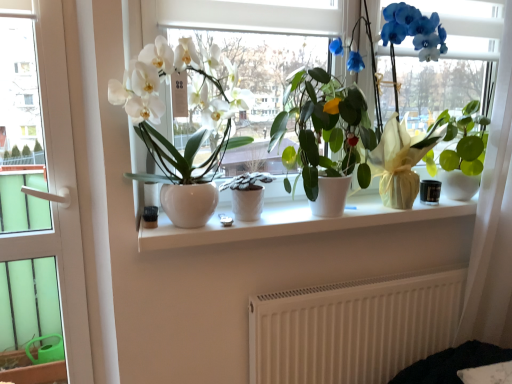
Question: Choose the correct answer: Is white sheer curtain at right inside green glossy leafy plant at right, acting as the 3th houseplant starting from the left, or outside it?

Choices:
 (A) outside
 (B) inside

Answer: (A)

Question: Is point (477, 206) closer or farther from the camera than point (450, 150)?

Choices:
 (A) closer
 (B) farther

Answer: (B)

Question: Which is farther from the white matte radiator at lower center?

Choices:
 (A) matte white vase at center, acting as the 3th houseplant starting from the right
 (B) white sheer curtain at right
 (C) white textured pot at center, which appears as the 2th houseplant when viewed from the right
 (D) green glossy leafy plant at right, acting as the 3th houseplant starting from the left
 (E) white glossy vase at center

Answer: (E)

Question: Considering the real-world distances, which object is farthest from the white sheer curtain at right?

Choices:
 (A) matte white vase at center, acting as the 3th houseplant starting from the right
 (B) white textured pot at center, the second houseplant in the left-to-right sequence
 (C) white ceramic window sill at center
 (D) white matte radiator at lower center
 (E) white glossy vase at center

Answer: (A)